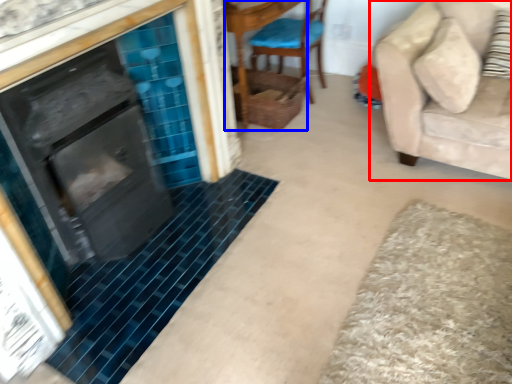
Question: Which of the following is the farthest to the observer, studio couch (highlighted by a red box) or side table (highlighted by a blue box)?

Choices:
 (A) studio couch
 (B) side table

Answer: (B)